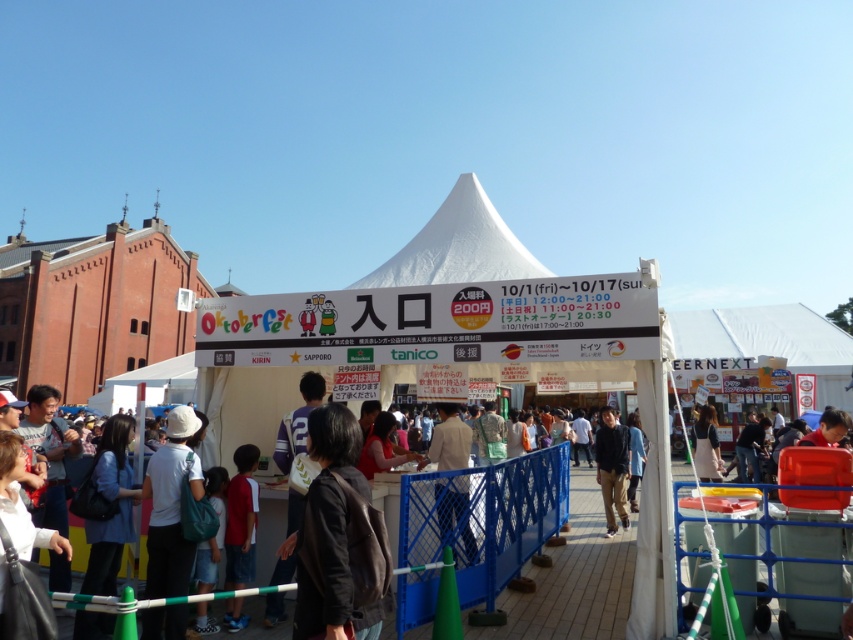
Can you confirm if black leather jacket at center is bigger than dark blue jacket at center?

No, black leather jacket at center is not bigger than dark blue jacket at center.

Does point (344, 412) come in front of point (624, 426)?

Yes, it is.

Find the location of `black leather jacket at center`. black leather jacket at center is located at coordinates (335, 536).

Does white fabric tent at center have a greater width compared to light brown jacket at center?

Yes.

Where is `white fabric tent at center`? white fabric tent at center is located at coordinates (505, 284).

Does black leather jacket at center appear under white fabric bag at center?

No.

Does black leather jacket at center appear on the right side of white fabric bag at center?

Indeed, black leather jacket at center is positioned on the right side of white fabric bag at center.

Does point (346, 508) come behind point (189, 492)?

No, it is in front of (189, 492).

At what (x,y) coordinates should I click in order to perform the action: click on black leather jacket at center. Please return your answer as a coordinate pair (x, y). The width and height of the screenshot is (853, 640). Looking at the image, I should click on (335, 536).